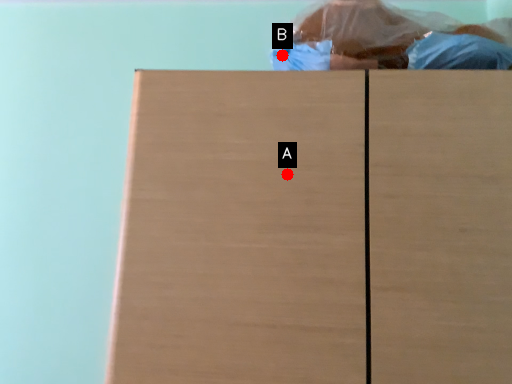
Question: Two points are circled on the image, labeled by A and B beside each circle. Which point is further to the camera?

Choices:
 (A) A is further
 (B) B is further

Answer: (B)